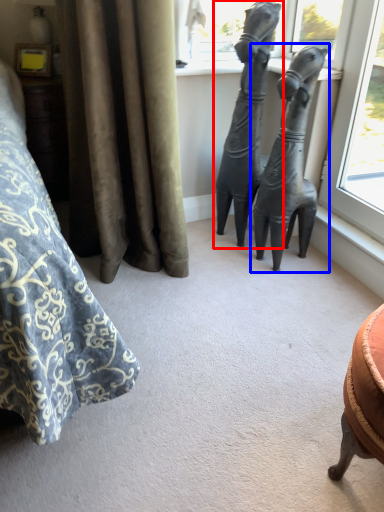
Question: Which object is further to the camera taking this photo, statue (sculpture) (highlighted by a red box) or statue (sculpture) (highlighted by a blue box)?

Choices:
 (A) statue (sculpture)
 (B) statue (sculpture)

Answer: (A)